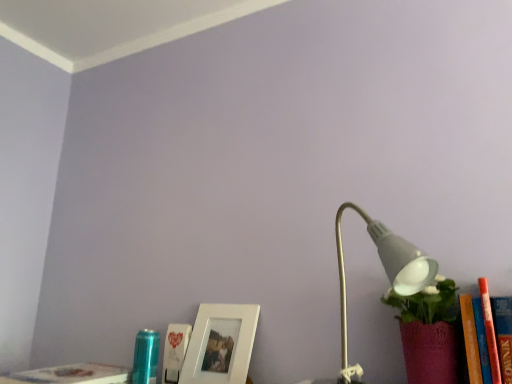
Question: Does white paper at lower center, acting as the second book starting from the left, have a lesser height compared to hardcover book at lower left, arranged as the 2th book when viewed from the right?

Choices:
 (A) yes
 (B) no

Answer: (B)

Question: Is white paper at lower center, acting as the second book starting from the left, far away from hardcover book at lower left, arranged as the 2th book when viewed from the right?

Choices:
 (A) no
 (B) yes

Answer: (A)

Question: Is white paper at lower center, acting as the second book starting from the left, positioned behind hardcover book at lower left, the 1th book in the left-to-right sequence?

Choices:
 (A) yes
 (B) no

Answer: (A)

Question: Considering the relative positions of white paper at lower center, which ranks as the first book in right-to-left order, and hardcover book at lower left, the 1th book in the left-to-right sequence, in the image provided, is white paper at lower center, which ranks as the first book in right-to-left order, to the left of hardcover book at lower left, the 1th book in the left-to-right sequence, from the viewer's perspective?

Choices:
 (A) no
 (B) yes

Answer: (A)

Question: Can you confirm if white paper at lower center, acting as the second book starting from the left, is smaller than hardcover book at lower left, arranged as the 2th book when viewed from the right?

Choices:
 (A) no
 (B) yes

Answer: (B)

Question: Is white paper at lower center, acting as the second book starting from the left, bigger than hardcover book at lower left, the 1th book in the left-to-right sequence?

Choices:
 (A) no
 (B) yes

Answer: (A)

Question: Does hardcover book at lower left, the 1th book in the left-to-right sequence, have a lesser height compared to white matte lamp at right?

Choices:
 (A) yes
 (B) no

Answer: (A)

Question: Is hardcover book at lower left, the 1th book in the left-to-right sequence, looking in the opposite direction of white matte lamp at right?

Choices:
 (A) yes
 (B) no

Answer: (B)

Question: From the image's perspective, is hardcover book at lower left, the 1th book in the left-to-right sequence, under white matte lamp at right?

Choices:
 (A) no
 (B) yes

Answer: (B)

Question: Is hardcover book at lower left, arranged as the 2th book when viewed from the right, bigger than white matte lamp at right?

Choices:
 (A) yes
 (B) no

Answer: (B)

Question: Is hardcover book at lower left, arranged as the 2th book when viewed from the right, at the left side of white matte lamp at right?

Choices:
 (A) no
 (B) yes

Answer: (B)

Question: From the image's perspective, is hardcover book at lower left, the 1th book in the left-to-right sequence, located above white matte lamp at right?

Choices:
 (A) no
 (B) yes

Answer: (A)

Question: Considering the relative sizes of white paper at lower center, acting as the second book starting from the left, and white matte picture frame at lower center in the image provided, is white paper at lower center, acting as the second book starting from the left, bigger than white matte picture frame at lower center?

Choices:
 (A) no
 (B) yes

Answer: (A)